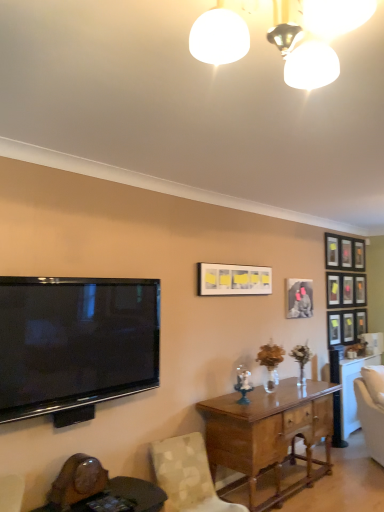
Identify the location of empty space that is ontop of matte white picture frame at center, the 6th picture frame viewed from the right (from a real-world perspective). This screenshot has height=512, width=384. coord(234,265).